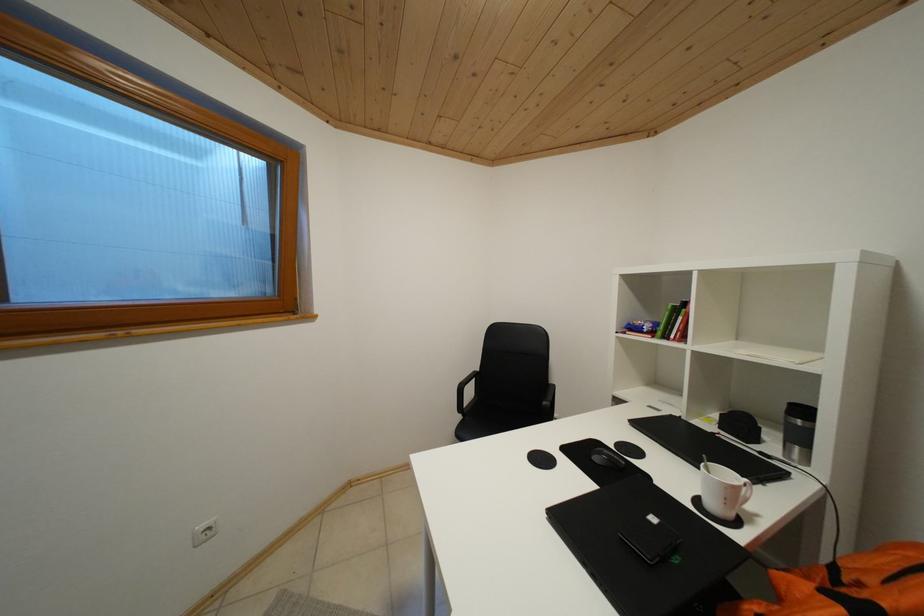
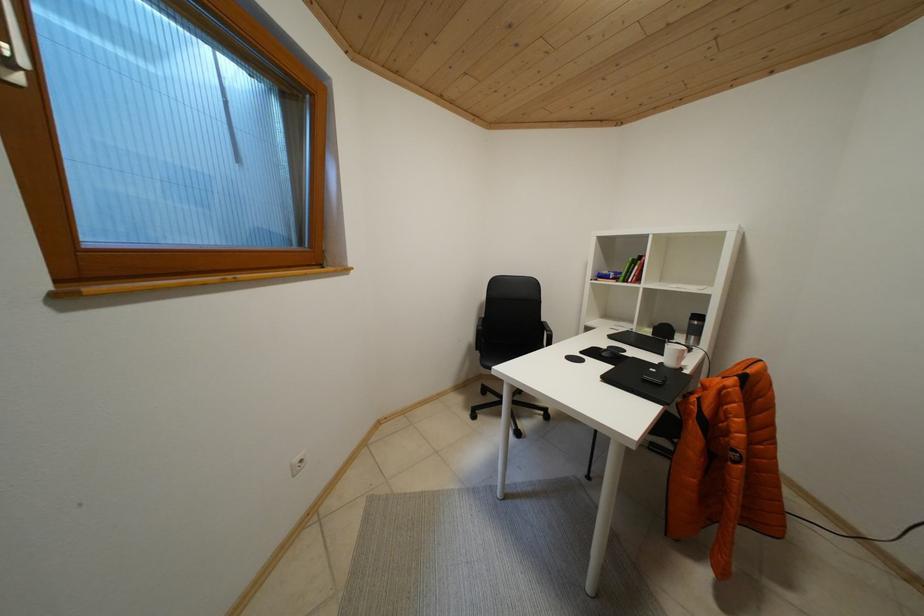
Question: How did the camera likely rotate?

Choices:
 (A) Left
 (B) Right
 (C) Up
 (D) Down

Answer: (B)